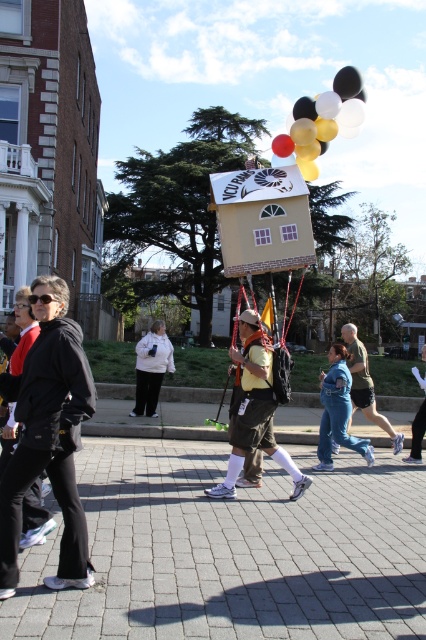
Is denim pants at center further to camera compared to white matte jacket at center?

No, denim pants at center is closer to the viewer.

Based on the photo, is denim pants at center below white matte jacket at center?

No.

What do you see at coordinates (337, 410) in the screenshot? I see `denim pants at center` at bounding box center [337, 410].

The height and width of the screenshot is (640, 426). Find the location of `denim pants at center`. denim pants at center is located at coordinates (337, 410).

Which is more to the left, brick pavement at center or yellow fabric house at center?

From the viewer's perspective, brick pavement at center appears more on the left side.

Who is higher up, brick pavement at center or yellow fabric house at center?

yellow fabric house at center

Is point (213, 531) behind point (264, 353)?

No.

Locate an element on the screen. The height and width of the screenshot is (640, 426). brick pavement at center is located at coordinates (232, 552).

Does black matte jacket at left have a greater width compared to matte black balloons at upper center?

Incorrect, black matte jacket at left's width does not surpass matte black balloons at upper center's.

What do you see at coordinates (48, 435) in the screenshot? This screenshot has height=640, width=426. I see `black matte jacket at left` at bounding box center [48, 435].

Locate an element on the screen. black matte jacket at left is located at coordinates (48, 435).